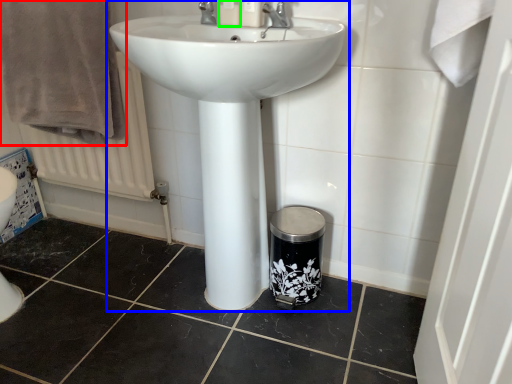
Question: Considering the real-world distances, which object is closest to bath towel (highlighted by a red box)? sink (highlighted by a blue box) or toiletry (highlighted by a green box).

Choices:
 (A) sink
 (B) toiletry

Answer: (A)